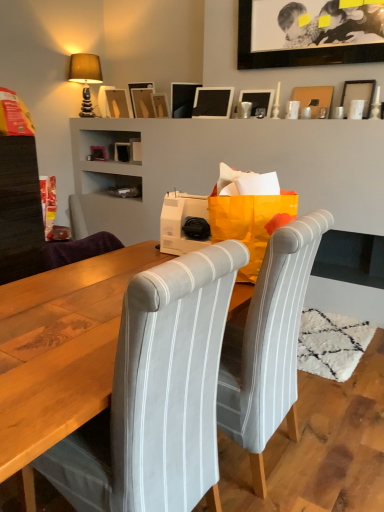
Question: From the image's perspective, would you say matte black picture frame at upper center, acting as the 5th picture frame starting from the left, is positioned over black matte picture frame at upper center, positioned as the seventh picture frame in left-to-right order?

Choices:
 (A) yes
 (B) no

Answer: (B)

Question: Is matte black picture frame at upper center, acting as the 5th picture frame starting from the left, thinner than black matte picture frame at upper center, positioned as the seventh picture frame in left-to-right order?

Choices:
 (A) no
 (B) yes

Answer: (A)

Question: Is matte black picture frame at upper center, which is the 5th picture frame from right to left, placed right next to black matte picture frame at upper center, positioned as the seventh picture frame in left-to-right order?

Choices:
 (A) no
 (B) yes

Answer: (A)

Question: Would you consider matte black picture frame at upper center, which is the 5th picture frame from right to left, to be distant from black matte picture frame at upper center, positioned as the seventh picture frame in left-to-right order?

Choices:
 (A) no
 (B) yes

Answer: (A)

Question: Considering the relative sizes of matte black picture frame at upper center, which is the 5th picture frame from right to left, and black matte picture frame at upper center, positioned as the seventh picture frame in left-to-right order, in the image provided, is matte black picture frame at upper center, which is the 5th picture frame from right to left, shorter than black matte picture frame at upper center, positioned as the seventh picture frame in left-to-right order,?

Choices:
 (A) no
 (B) yes

Answer: (B)

Question: Is matte black picture frame at upper center, which is the 5th picture frame from right to left, oriented away from black matte picture frame at upper center, positioned as the seventh picture frame in left-to-right order?

Choices:
 (A) yes
 (B) no

Answer: (B)

Question: Considering the relative sizes of matte wood picture frame at upper center, the 9th picture frame viewed from the right, and matte cardboard picture frame at upper center, which is the 2th picture frame from right to left, in the image provided, is matte wood picture frame at upper center, the 9th picture frame viewed from the right, thinner than matte cardboard picture frame at upper center, which is the 2th picture frame from right to left,?

Choices:
 (A) yes
 (B) no

Answer: (B)

Question: Is matte wood picture frame at upper center, marked as the 1th picture frame in a left-to-right arrangement, further to the viewer compared to matte cardboard picture frame at upper center, the eighth picture frame when ordered from left to right?

Choices:
 (A) yes
 (B) no

Answer: (A)

Question: Does matte wood picture frame at upper center, marked as the 1th picture frame in a left-to-right arrangement, have a greater height compared to matte cardboard picture frame at upper center, the eighth picture frame when ordered from left to right?

Choices:
 (A) no
 (B) yes

Answer: (B)

Question: From the image's perspective, would you say matte wood picture frame at upper center, marked as the 1th picture frame in a left-to-right arrangement, is shown under matte cardboard picture frame at upper center, the eighth picture frame when ordered from left to right?

Choices:
 (A) yes
 (B) no

Answer: (B)

Question: Is matte cardboard picture frame at upper center, the eighth picture frame when ordered from left to right, surrounded by matte wood picture frame at upper center, marked as the 1th picture frame in a left-to-right arrangement?

Choices:
 (A) no
 (B) yes

Answer: (A)

Question: From the image's perspective, is matte wood picture frame at upper center, the 9th picture frame viewed from the right, on matte cardboard picture frame at upper center, which is the 2th picture frame from right to left?

Choices:
 (A) no
 (B) yes

Answer: (B)

Question: Can you confirm if matte black picture frame at upper center, acting as the 5th picture frame starting from the left, is bigger than wooden picture frame at upper center, the seventh picture frame when ordered from right to left?

Choices:
 (A) no
 (B) yes

Answer: (B)